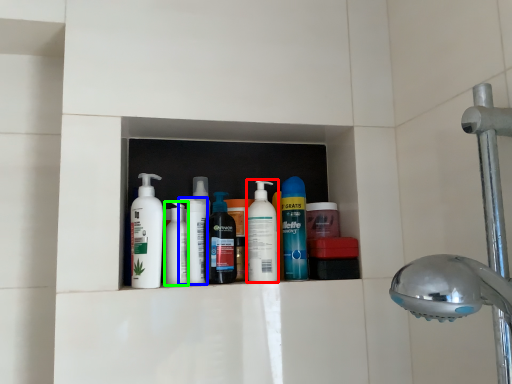
Question: Which object is positioned farthest from cleaning product (highlighted by a red box)? Select from cleaning product (highlighted by a blue box) and toiletry (highlighted by a green box).

Choices:
 (A) cleaning product
 (B) toiletry

Answer: (B)